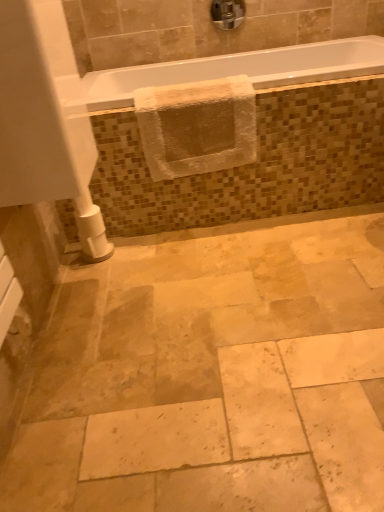
I want to click on empty space that is ontop of natural stone tile at center (from a real-world perspective), so click(x=241, y=316).